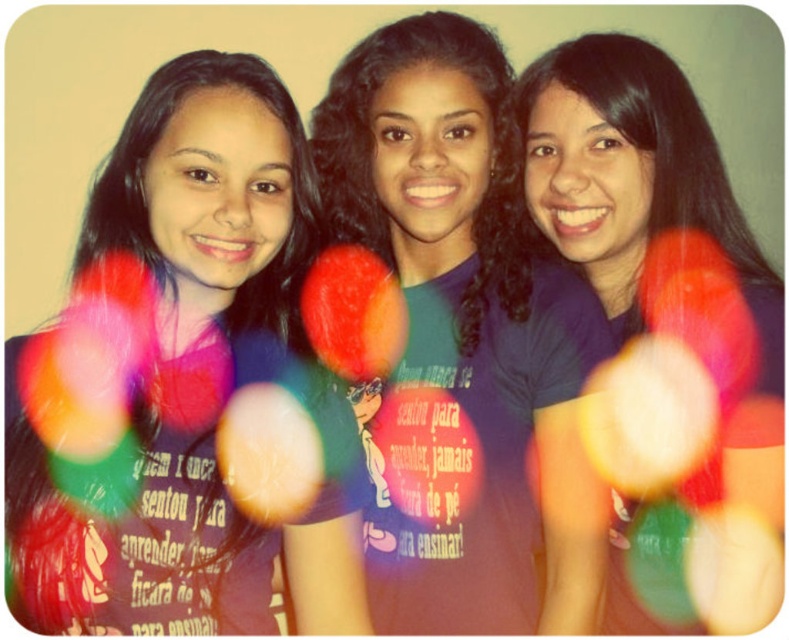
Is point (214, 236) farther from viewer compared to point (556, 189)?

No, it is not.

Is point (273, 92) positioned behind point (615, 138)?

That is False.

Where is `matte purple shirt at center`? The height and width of the screenshot is (640, 789). matte purple shirt at center is located at coordinates (196, 392).

Is dark green t-shirt at center behind purple matte shirt at center?

Yes, dark green t-shirt at center is behind purple matte shirt at center.

Does dark green t-shirt at center have a larger size compared to purple matte shirt at center?

Correct, dark green t-shirt at center is larger in size than purple matte shirt at center.

Describe the element at coordinates (466, 340) in the screenshot. I see `dark green t-shirt at center` at that location.

The image size is (789, 640). What are the coordinates of `dark green t-shirt at center` in the screenshot? It's located at (466, 340).

Is matte purple shirt at center above dark green t-shirt at center?

Incorrect, matte purple shirt at center is not positioned above dark green t-shirt at center.

Can you confirm if matte purple shirt at center is thinner than dark green t-shirt at center?

Indeed, matte purple shirt at center has a lesser width compared to dark green t-shirt at center.

Is point (193, 396) closer to camera compared to point (559, 452)?

Yes, point (193, 396) is closer to viewer.

This screenshot has width=789, height=640. Find the location of `matte purple shirt at center`. matte purple shirt at center is located at coordinates (196, 392).